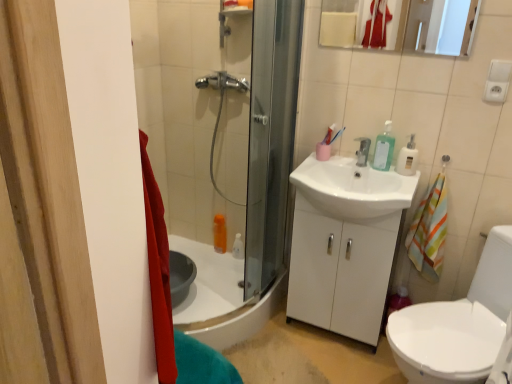
Question: Is the depth of matte white mirror at upper center greater than that of translucent plastic soap dispenser at upper right?

Choices:
 (A) no
 (B) yes

Answer: (A)

Question: Are matte white mirror at upper center and translucent plastic soap dispenser at upper right beside each other?

Choices:
 (A) no
 (B) yes

Answer: (A)

Question: Considering the relative sizes of matte white mirror at upper center and translucent plastic soap dispenser at upper right in the image provided, is matte white mirror at upper center bigger than translucent plastic soap dispenser at upper right?

Choices:
 (A) yes
 (B) no

Answer: (B)

Question: Is matte white mirror at upper center to the left of translucent plastic soap dispenser at upper right from the viewer's perspective?

Choices:
 (A) yes
 (B) no

Answer: (A)

Question: From the image's perspective, is matte white mirror at upper center beneath translucent plastic soap dispenser at upper right?

Choices:
 (A) yes
 (B) no

Answer: (B)

Question: Is matte white mirror at upper center positioned in front of translucent plastic soap dispenser at upper right?

Choices:
 (A) yes
 (B) no

Answer: (A)

Question: Can you confirm if clear plastic soap dispenser at upper right is positioned to the right of white glossy sink at center?

Choices:
 (A) no
 (B) yes

Answer: (B)

Question: Does clear plastic soap dispenser at upper right turn towards white glossy sink at center?

Choices:
 (A) no
 (B) yes

Answer: (A)

Question: Can you confirm if clear plastic soap dispenser at upper right is thinner than white glossy sink at center?

Choices:
 (A) yes
 (B) no

Answer: (A)

Question: Does clear plastic soap dispenser at upper right appear on the left side of white glossy sink at center?

Choices:
 (A) yes
 (B) no

Answer: (B)

Question: Does clear plastic soap dispenser at upper right have a greater width compared to white glossy sink at center?

Choices:
 (A) yes
 (B) no

Answer: (B)

Question: Is clear plastic soap dispenser at upper right taller than white glossy sink at center?

Choices:
 (A) no
 (B) yes

Answer: (A)

Question: Is white glossy sink at center closer to camera compared to matte white mirror at upper center?

Choices:
 (A) yes
 (B) no

Answer: (A)